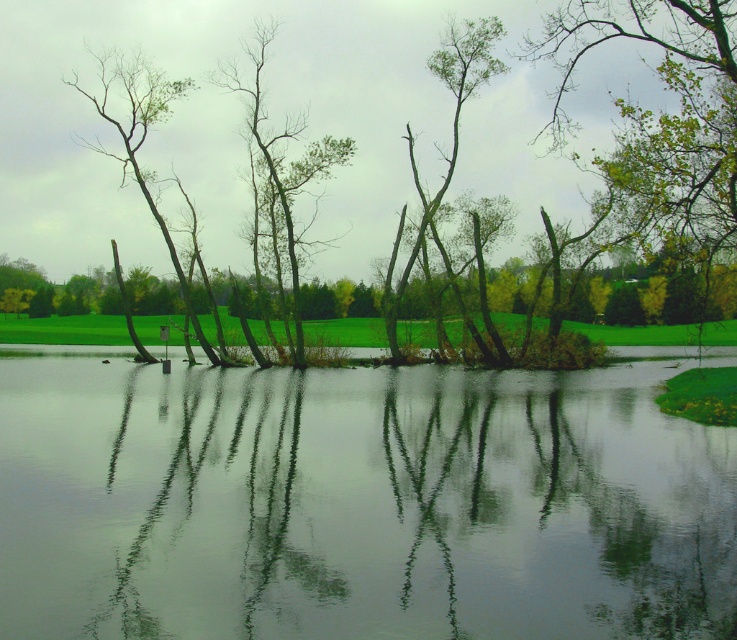
You are standing at the edge of the water and see two points marked in the image. Which point, point [468,70] or point [171,90], is closer to you?

Point [468,70] is closer to the viewer than point [171,90].

You are a bird looking for a place to perch. You see a green leafy tree at center and a bare wood tree at left. Which tree is closer to the left edge of the image?

The bare wood tree at left is closer to the left edge of the image because it is positioned on the left side of the green leafy tree at center.

You are standing on a wooden bridge observing the green leafy tree at center and the bare wood tree at left. Which tree is closer to the bridge?

The green leafy tree at center is closer to the bridge because it is positioned under the bare wood tree at left, meaning it is in front of the latter from your viewpoint.